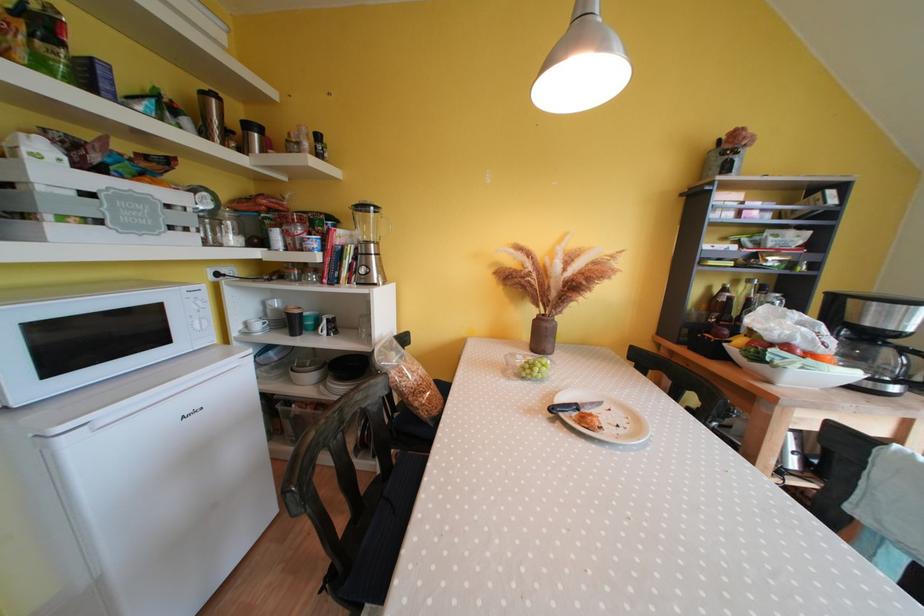
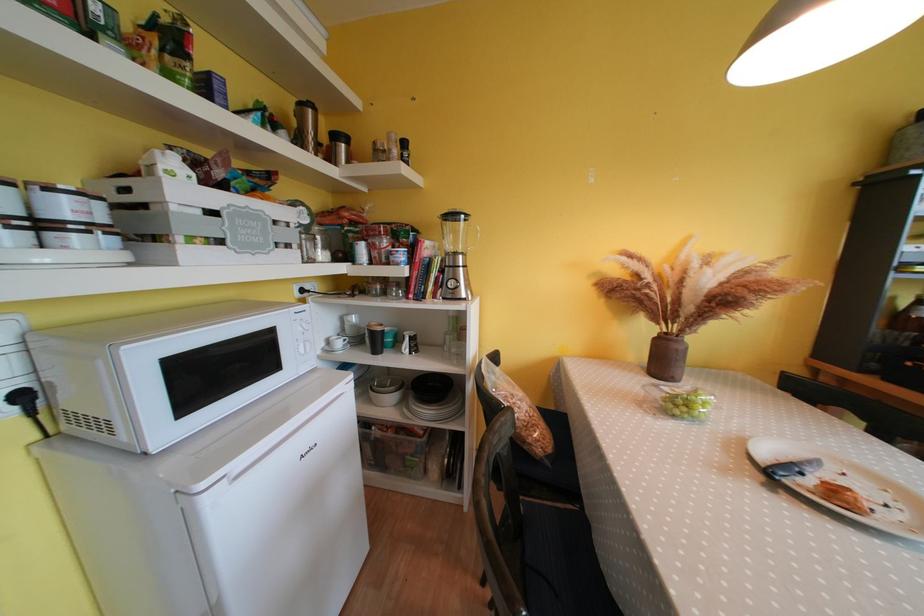
In the second image, find the point that corresponds to (x=252, y=130) in the first image.

(342, 140)